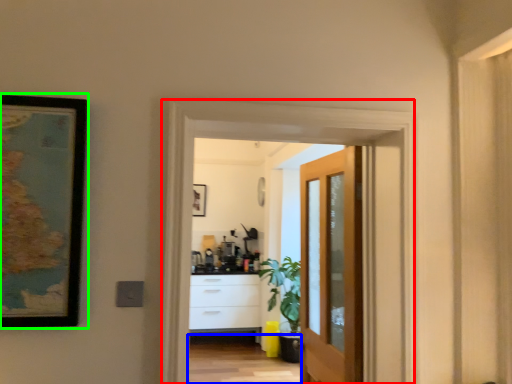
Question: Estimate the real-world distances between objects in this image. Which object is farther from screen door (highlighted by a red box), path (highlighted by a blue box) or picture frame (highlighted by a green box)?

Choices:
 (A) path
 (B) picture frame

Answer: (A)